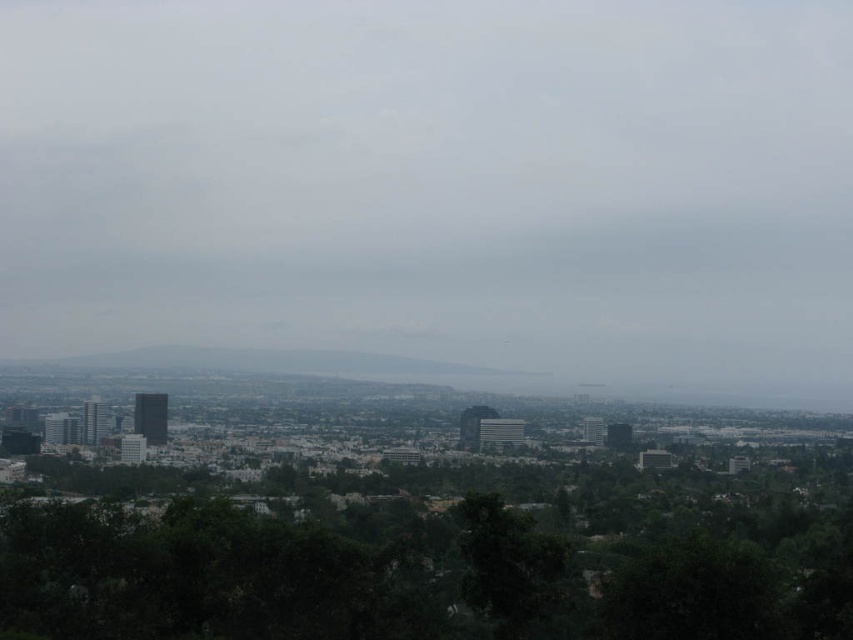
Can you confirm if gray matte cloud at center is positioned below green leafy tree at lower center?

Incorrect, gray matte cloud at center is not positioned below green leafy tree at lower center.

How far apart are gray matte cloud at center and green leafy tree at lower center?

They are 15.17 feet apart.

The width and height of the screenshot is (853, 640). I want to click on gray matte cloud at center, so click(436, 182).